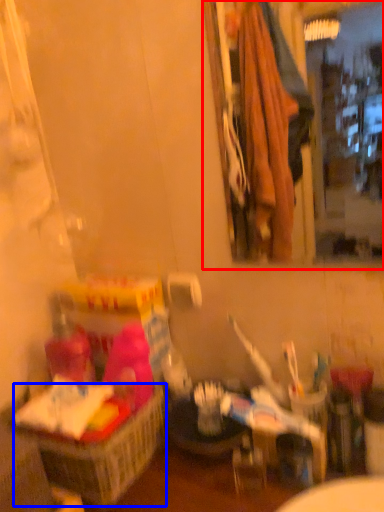
Question: Which of the following is the closest to the observer, mirror (highlighted by a red box) or basket (highlighted by a blue box)?

Choices:
 (A) mirror
 (B) basket

Answer: (A)